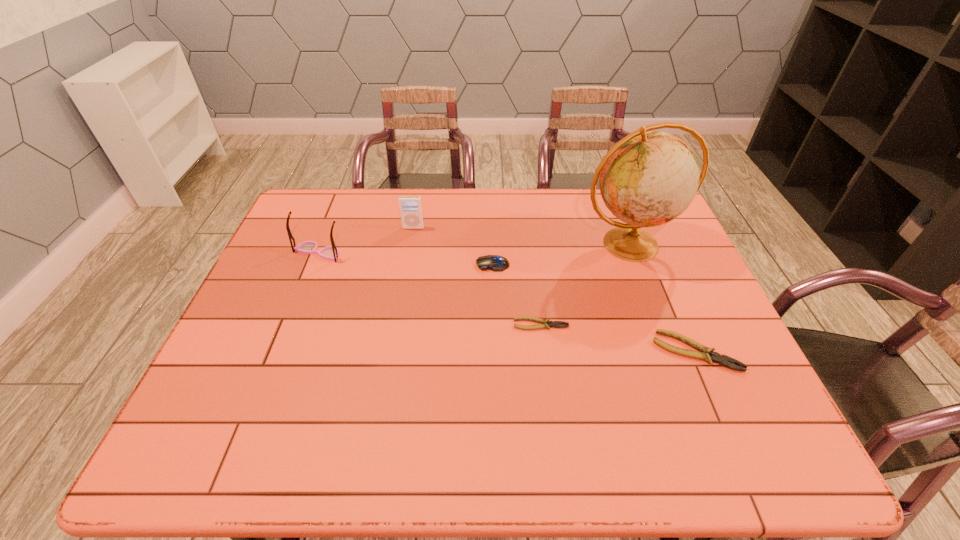
This screenshot has width=960, height=540. What are the coordinates of `free spot that satisfies the following two spatial constraints: 1. on the front-facing side of the fifth object from right to left; 2. on the right side of the tallest object` in the screenshot? It's located at click(x=411, y=245).

Identify the location of free space that satisfies the following two spatial constraints: 1. on the back side of the globe; 2. on the right side of the leftmost object. (322, 245).

Locate an element on the screen. free space in the image that satisfies the following two spatial constraints: 1. on the front-facing side of the fifth object from right to left; 2. on the right side of the farther pliers is located at coordinates (396, 324).

The height and width of the screenshot is (540, 960). I want to click on blank space that satisfies the following two spatial constraints: 1. on the front-facing side of the second object from left to right; 2. on the right side of the tallest object, so click(411, 245).